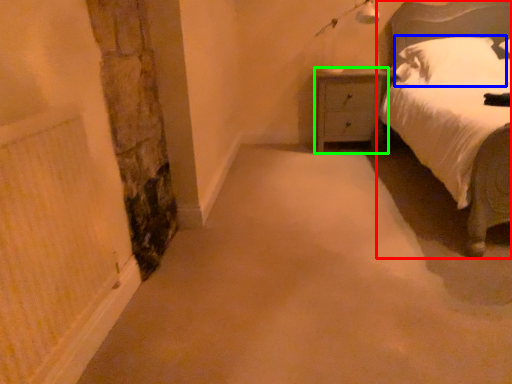
Question: Based on their relative distances, which object is nearer to bed (highlighted by a red box)? Choose from pillow (highlighted by a blue box) and nightstand (highlighted by a green box).

Choices:
 (A) pillow
 (B) nightstand

Answer: (A)